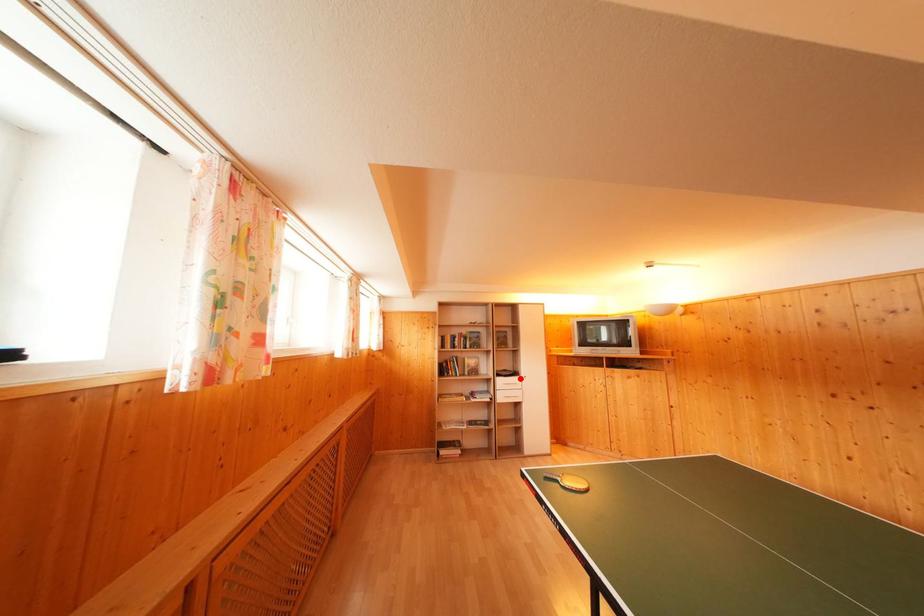
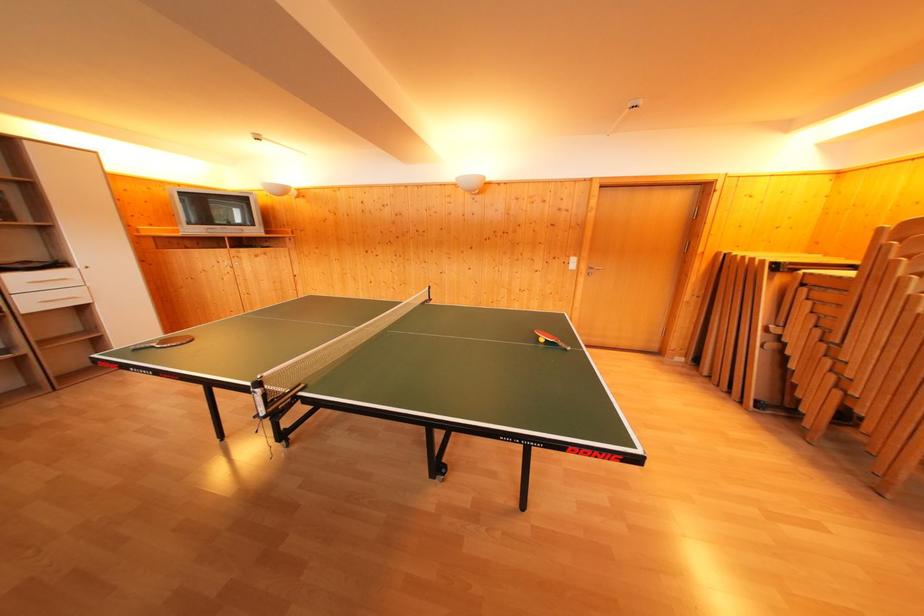
Locate, in the second image, the point that corresponds to the highlighted location in the first image.

(64, 270)